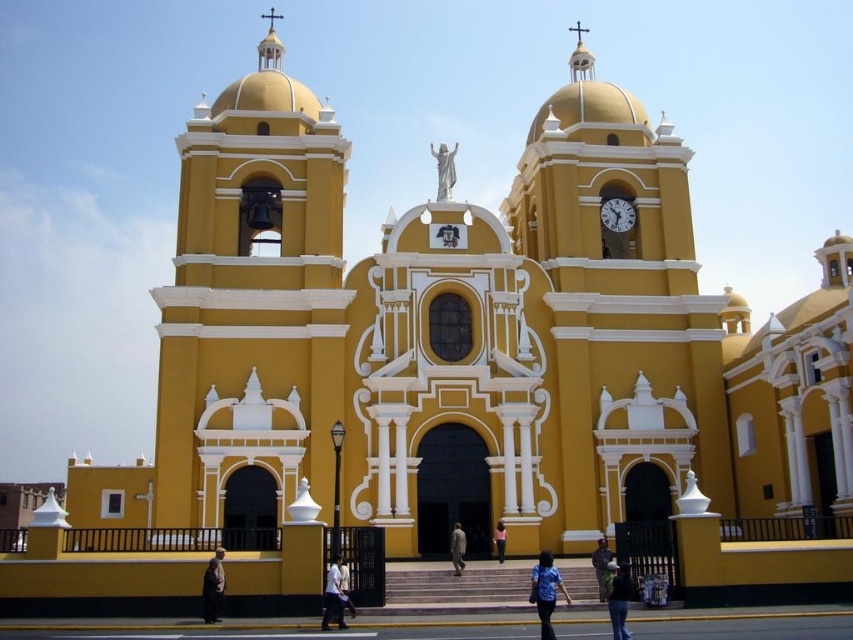
Is blue fabric shirt at lower center bigger than dark green fabric jacket at center?

Yes.

Which is more to the right, blue fabric shirt at lower center or dark green fabric jacket at center?

Positioned to the right is dark green fabric jacket at center.

Does point (566, 600) lie behind point (610, 614)?

Yes, point (566, 600) is farther from viewer.

Where is `blue fabric shirt at lower center`? The height and width of the screenshot is (640, 853). blue fabric shirt at lower center is located at coordinates (544, 592).

This screenshot has height=640, width=853. What do you see at coordinates (346, 588) in the screenshot?
I see `white cotton shirt at center` at bounding box center [346, 588].

Identify the location of white cotton shirt at center. The width and height of the screenshot is (853, 640). (346, 588).

Where is `white cotton shirt at center`? The image size is (853, 640). white cotton shirt at center is located at coordinates (346, 588).

Between white matte shirt at center and dark brown leather jacket at lower left, which one appears on the left side from the viewer's perspective?

Positioned to the left is dark brown leather jacket at lower left.

Is white matte shirt at center smaller than dark brown leather jacket at lower left?

Actually, white matte shirt at center might be larger than dark brown leather jacket at lower left.

Identify the location of white matte shirt at center. The height and width of the screenshot is (640, 853). (334, 595).